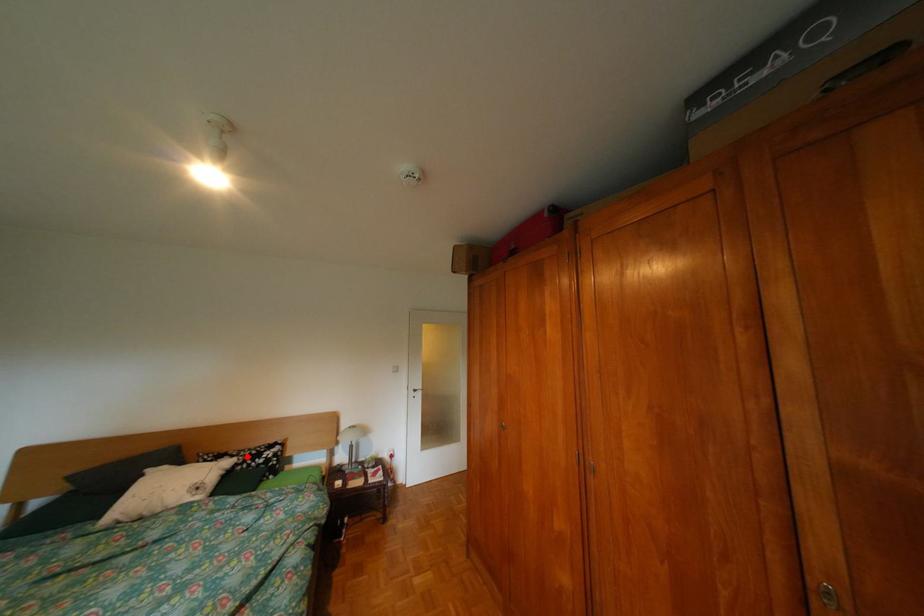
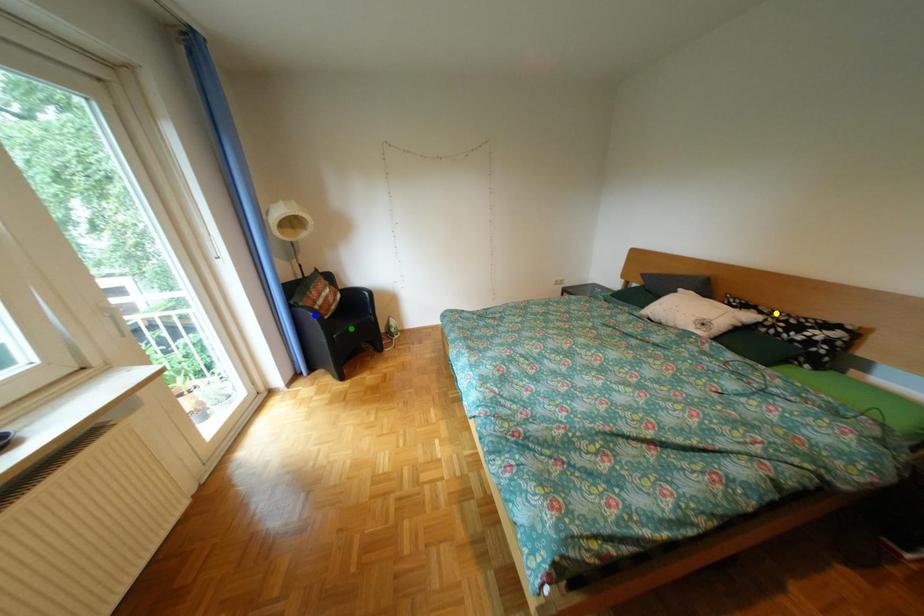
Question: I am providing you with two images of the same scene from different viewpoints. A red point is marked on the first image. You are given multiple points on the second image. Which spot in image 2 lines up with the point in image 1?

Choices:
 (A) yellow point
 (B) blue point
 (C) green point

Answer: (A)